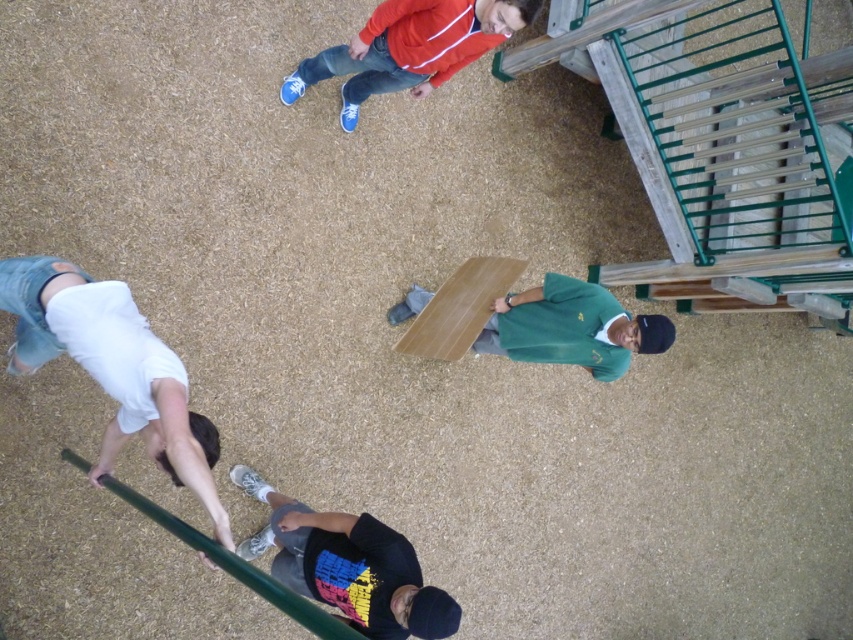
Question: Is white cotton shirt at lower left thinner than black matte t-shirt at lower center?

Choices:
 (A) no
 (B) yes

Answer: (A)

Question: Can you confirm if white cotton shirt at lower left is positioned below black matte t-shirt at lower center?

Choices:
 (A) no
 (B) yes

Answer: (A)

Question: Can you confirm if white cotton shirt at lower left is positioned to the right of black matte t-shirt at lower center?

Choices:
 (A) no
 (B) yes

Answer: (A)

Question: Among these objects, which one is farthest from the camera?

Choices:
 (A) black matte t-shirt at lower center
 (B) white cotton shirt at lower left

Answer: (A)

Question: Which point is farther from the camera taking this photo?

Choices:
 (A) (106, 314)
 (B) (262, 490)

Answer: (B)